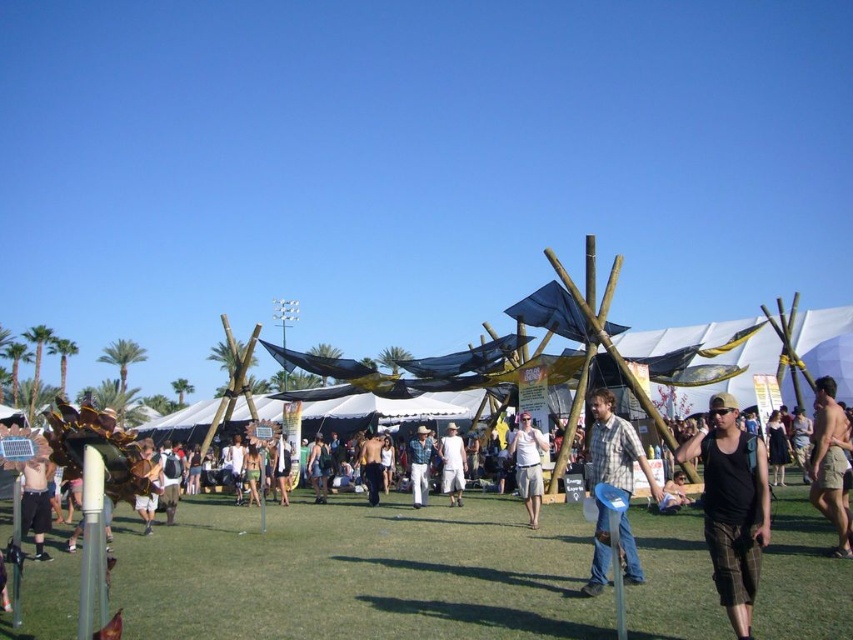
Question: Based on their relative distances, which object is farther from the brown leather jacket at center?

Choices:
 (A) black shorts at lower left
 (B) green grass at center

Answer: (B)

Question: Is green grass at center closer to the viewer compared to white cotton shorts at center?

Choices:
 (A) no
 (B) yes

Answer: (B)

Question: Which of the following is the closest to the observer?

Choices:
 (A) denim pants at center
 (B) green grass at center
 (C) brown leather jacket at center
 (D) skinny shirtless man at center

Answer: (B)

Question: Can you confirm if black shorts at lower left is bigger than brown leather jacket at center?

Choices:
 (A) yes
 (B) no

Answer: (B)

Question: Which object appears farthest from the camera in this image?

Choices:
 (A) tan shorts at lower right
 (B) black shorts at lower left

Answer: (A)

Question: Can you confirm if white cotton shorts at center is thinner than brown leather jacket at center?

Choices:
 (A) no
 (B) yes

Answer: (B)